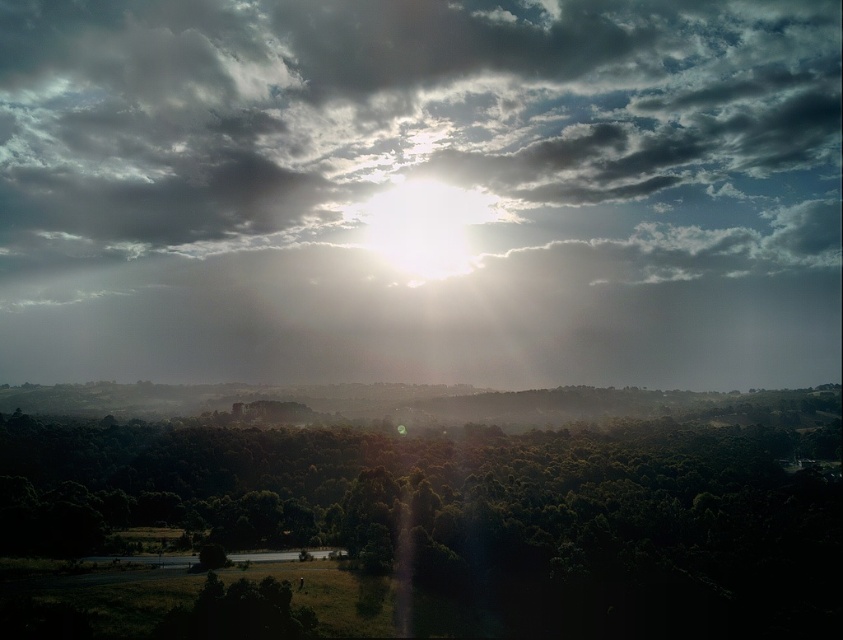
You are standing in the landscape scene and want to walk from the point at coordinates point (537, 353) to the point at coordinates point (707, 454). Which direction should you move relative to your current position?

You should move away from the camera because point (707, 454) is closer to the camera than point (537, 353).

You are standing in the middle of the dense vegetation and looking up at the sky. Which object is positioned to the left when comparing cloudy at upper center and green leafy tree at center?

The cloudy at upper center is positioned to the left of the green leafy tree at center.